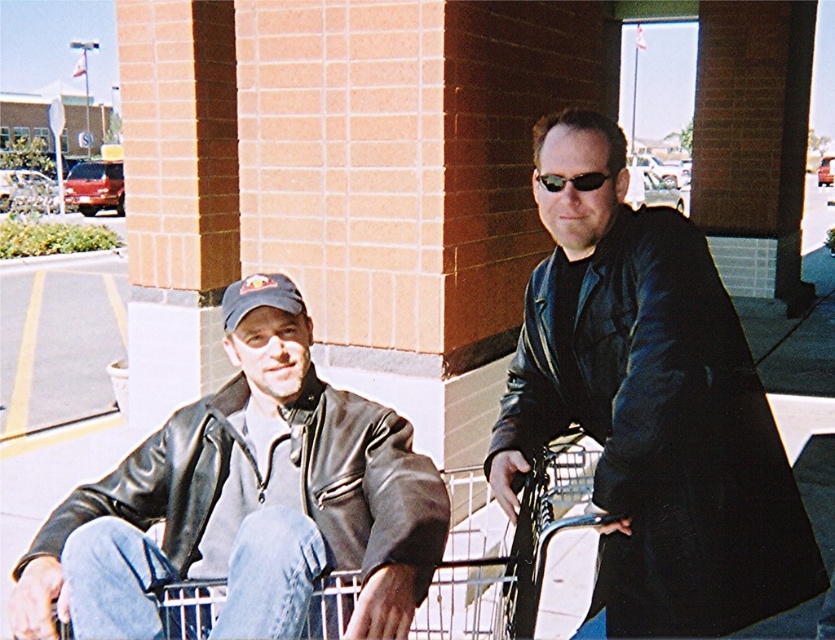
Question: Is matte black jacket at center further to camera compared to matte black jacket at left?

Choices:
 (A) yes
 (B) no

Answer: (A)

Question: Which object appears closest to the camera in this image?

Choices:
 (A) metallic silver shopping cart at lower center
 (B) matte black jacket at left
 (C) matte black jacket at center

Answer: (B)

Question: Where is matte black jacket at left located in relation to metallic silver shopping cart at lower center in the image?

Choices:
 (A) left
 (B) right

Answer: (A)

Question: Which object is farther from the camera taking this photo?

Choices:
 (A) matte black jacket at left
 (B) metallic silver shopping cart at lower center
 (C) matte black jacket at center

Answer: (B)

Question: Does matte black jacket at center appear over matte black jacket at left?

Choices:
 (A) yes
 (B) no

Answer: (A)

Question: Which of the following is the farthest from the observer?

Choices:
 (A) metallic silver shopping cart at lower center
 (B) matte black jacket at left
 (C) black plastic sunglasses at upper center

Answer: (C)